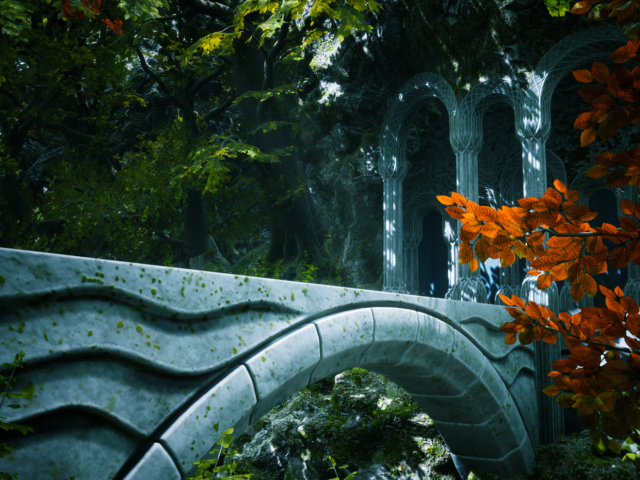
What are the coordinates of `top of arch` in the screenshot? It's located at (395, 328).